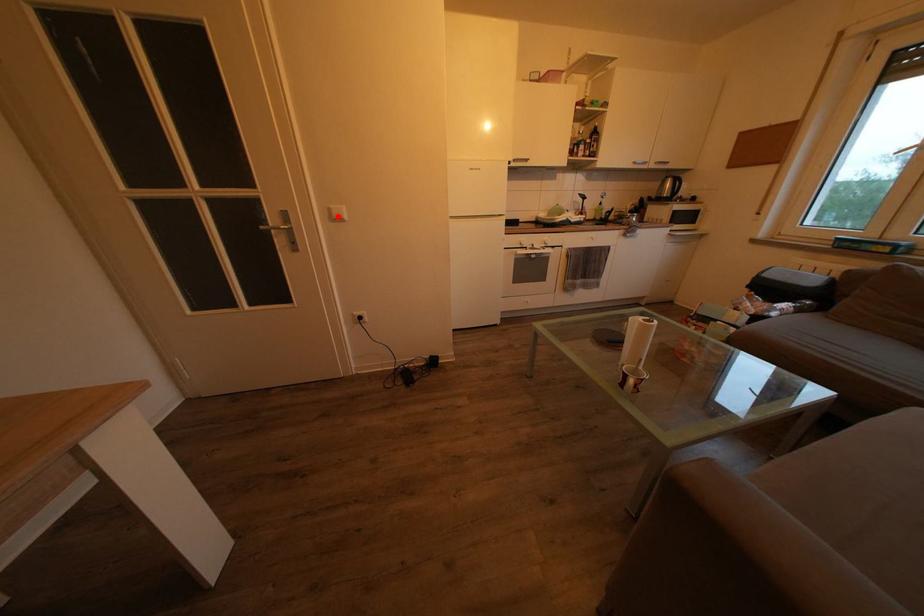
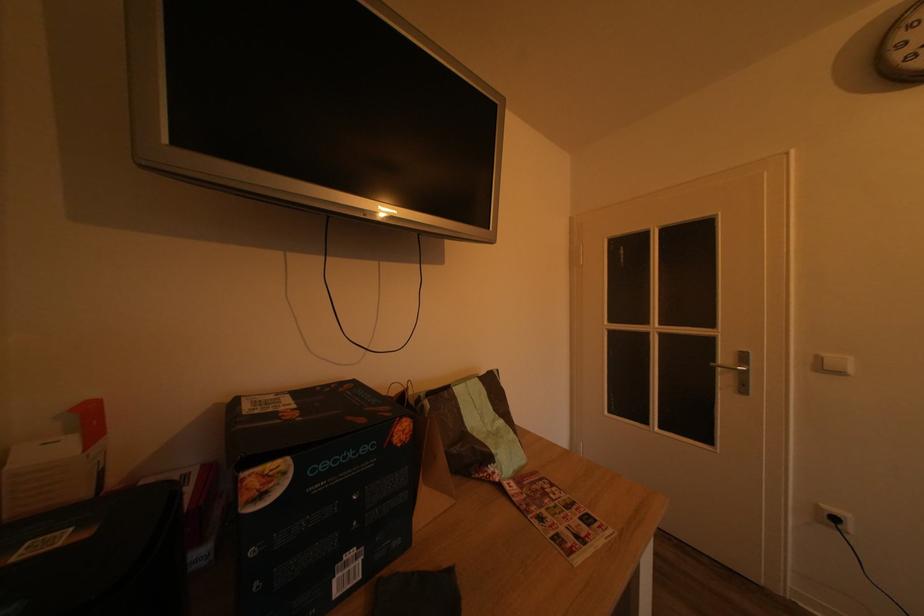
The point at the highlighted location is marked in the first image. Where is the corresponding point in the second image?

(825, 365)